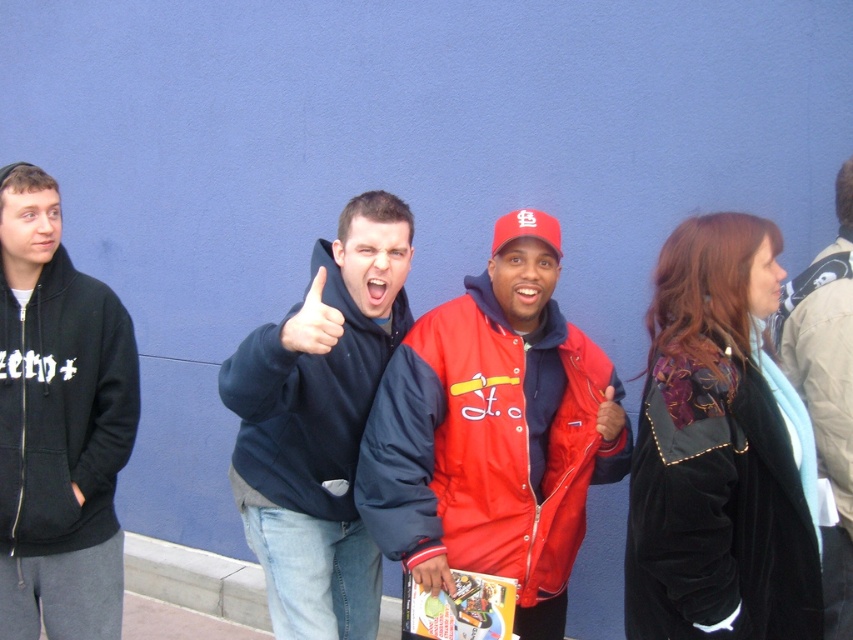
Question: Which point is farther to the camera?

Choices:
 (A) (451, 589)
 (B) (122, 448)
 (C) (299, 328)
 (D) (430, 449)

Answer: (B)

Question: Can you confirm if dark blue hoodie at center is thinner than smooth plastic hand at center?

Choices:
 (A) no
 (B) yes

Answer: (A)

Question: Which of the following is the farthest from the observer?

Choices:
 (A) red nylon jacket at center
 (B) light brown leather jacket at right
 (C) smooth plastic hand at center
 (D) black zip-up hoodie at left

Answer: (D)

Question: Is red nylon jacket at center to the left of matte black thumb at center from the viewer's perspective?

Choices:
 (A) no
 (B) yes

Answer: (A)

Question: Is red nylon jacket at center to the left of light brown leather jacket at right from the viewer's perspective?

Choices:
 (A) no
 (B) yes

Answer: (B)

Question: Which point is closer to the camera?

Choices:
 (A) light brown leather jacket at right
 (B) matte black thumb at center
 (C) black zip-up hoodie at left

Answer: (B)